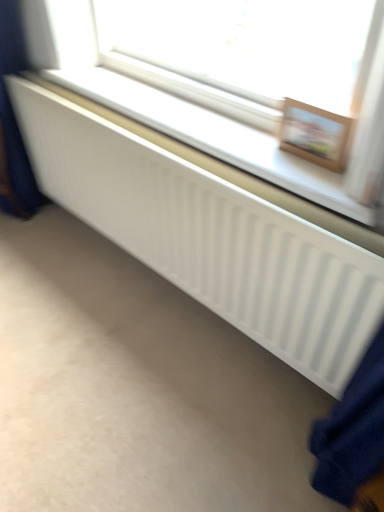
What is the approximate width of white matte radiator at center?

The width of white matte radiator at center is 7.61 inches.

What are the coordinates of `white matte radiator at center` in the screenshot? It's located at 231,78.

What do you see at coordinates (231, 78) in the screenshot? I see `white matte radiator at center` at bounding box center [231, 78].

Find the location of `wooden picture frame at upper right`. wooden picture frame at upper right is located at coordinates (315, 134).

This screenshot has height=512, width=384. What do you see at coordinates (315, 134) in the screenshot?
I see `wooden picture frame at upper right` at bounding box center [315, 134].

You are a GUI agent. You are given a task and a screenshot of the screen. Output one action in this format:
    pyautogui.click(x=<x>, y=<y>)
    Task: Click on the white matte radiator at center
    
    Given the screenshot: What is the action you would take?
    pyautogui.click(x=231, y=78)

Considering the relative positions of wooden picture frame at upper right and white matte radiator at center in the image provided, is wooden picture frame at upper right to the right of white matte radiator at center from the viewer's perspective?

Yes, wooden picture frame at upper right is to the right of white matte radiator at center.

Does wooden picture frame at upper right lie in front of white matte radiator at center?

No, it is not.

Is point (296, 144) more distant than point (315, 89)?

Yes, it is.

From the image's perspective, is wooden picture frame at upper right on white matte radiator at center?

No.

From a real-world perspective, which object rests below the other?

white matte radiator at center is physically lower.

Is wooden picture frame at upper right wider or thinner than white matte radiator at center?

wooden picture frame at upper right is thinner than white matte radiator at center.

Which of these two, wooden picture frame at upper right or white matte radiator at center, stands shorter?

Standing shorter between the two is white matte radiator at center.

Considering the relative sizes of wooden picture frame at upper right and white matte radiator at center in the image provided, is wooden picture frame at upper right smaller than white matte radiator at center?

Yes, wooden picture frame at upper right is smaller than white matte radiator at center.

In the scene shown: Is wooden picture frame at upper right not inside white matte radiator at center?

wooden picture frame at upper right is positioned outside white matte radiator at center.

Are wooden picture frame at upper right and white matte radiator at center located far from each other?

No, wooden picture frame at upper right is not far away from white matte radiator at center.

Is wooden picture frame at upper right aimed at white matte radiator at center?

No, wooden picture frame at upper right does not turn towards white matte radiator at center.

How many degrees apart are the facing directions of wooden picture frame at upper right and white matte radiator at center?

They differ by 0.00405 degrees in their facing directions.

This screenshot has width=384, height=512. I want to click on bay window located in front of the wooden picture frame at upper right, so click(x=231, y=78).

Does white matte radiator at center appear on the left side of wooden picture frame at upper right?

Yes.

Is the position of white matte radiator at center more distant than that of wooden picture frame at upper right?

No.

Is point (44, 71) more distant than point (330, 153)?

Yes, it is.

From the image's perspective, is white matte radiator at center located above wooden picture frame at upper right?

Yes, from the image's perspective, white matte radiator at center is on top of wooden picture frame at upper right.

From a real-world perspective, is white matte radiator at center positioned above or below wooden picture frame at upper right?

Clearly, from a real-world perspective, white matte radiator at center is below wooden picture frame at upper right.

Considering the relative sizes of white matte radiator at center and wooden picture frame at upper right in the image provided, is white matte radiator at center wider than wooden picture frame at upper right?

Correct, the width of white matte radiator at center exceeds that of wooden picture frame at upper right.

Considering the relative sizes of white matte radiator at center and wooden picture frame at upper right in the image provided, is white matte radiator at center taller than wooden picture frame at upper right?

In fact, white matte radiator at center may be shorter than wooden picture frame at upper right.

Can you confirm if white matte radiator at center is bigger than wooden picture frame at upper right?

Yes, white matte radiator at center is bigger than wooden picture frame at upper right.

Is white matte radiator at center not inside wooden picture frame at upper right?

Yes, white matte radiator at center is outside of wooden picture frame at upper right.

Are white matte radiator at center and wooden picture frame at upper right located far from each other?

They are positioned close to each other.

Is wooden picture frame at upper right at the back of white matte radiator at center?

white matte radiator at center is not turned away from wooden picture frame at upper right.

Find the location of `picture frame below the white matte radiator at center (from the image's perspective)`. picture frame below the white matte radiator at center (from the image's perspective) is located at coordinates (315, 134).

At what (x,y) coordinates should I click in order to perform the action: click on picture frame that is behind the white matte radiator at center. Please return your answer as a coordinate pair (x, y). Looking at the image, I should click on (315, 134).

I want to click on picture frame above the white matte radiator at center (from a real-world perspective), so click(315, 134).